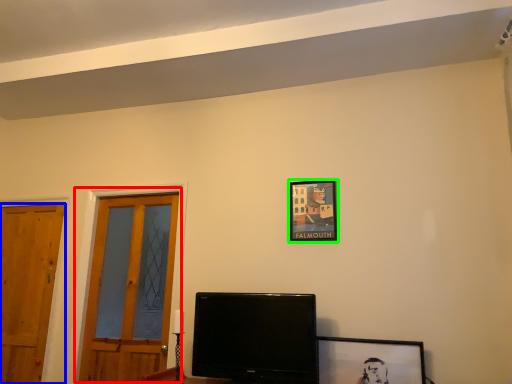
Question: Estimate the real-world distances between objects in this image. Which object is closer to door (highlighted by a red box), door (highlighted by a blue box) or picture frame (highlighted by a green box)?

Choices:
 (A) door
 (B) picture frame

Answer: (A)